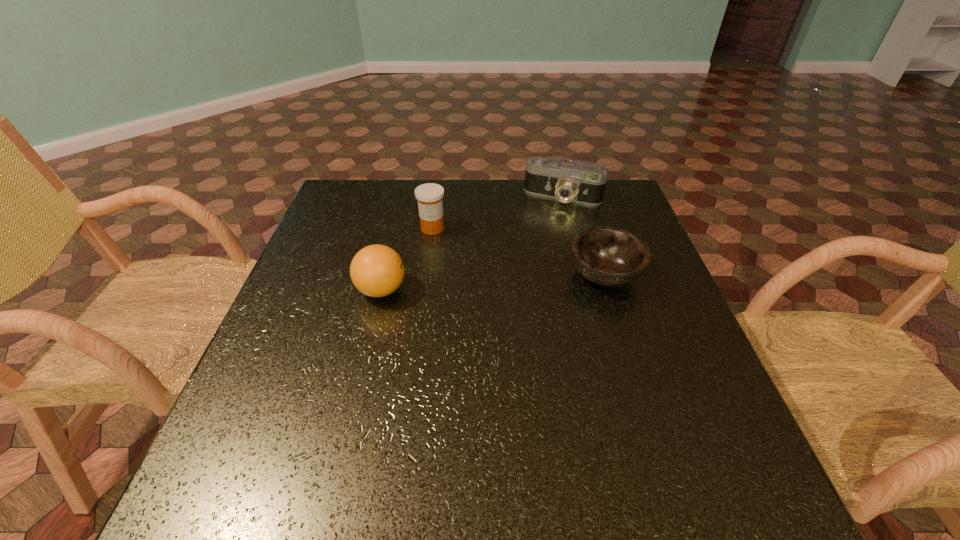
Identify the location of free spot at the near edge of the desktop. The height and width of the screenshot is (540, 960). (498, 407).

Where is `free space at the left edge`? free space at the left edge is located at coordinates (283, 328).

Where is `free space at the right edge of the desktop`? free space at the right edge of the desktop is located at coordinates point(621,305).

The image size is (960, 540). What are the coordinates of `vacant space at the far left corner` in the screenshot? It's located at (364, 217).

Find the location of a particular element. The width and height of the screenshot is (960, 540). free space at the far right corner of the desktop is located at coordinates (617, 211).

Where is `vacant space at the near right corner`? vacant space at the near right corner is located at coordinates click(706, 428).

I want to click on vacant point located between the shortest object and the leftmost object, so click(x=493, y=283).

Find the location of a particular element. free space that is in between the leftmost object and the medicine is located at coordinates (407, 259).

I want to click on free space between the third nearest object and the leftmost object, so click(407, 259).

Find the location of a particular element. The width and height of the screenshot is (960, 540). blank region between the bowl and the medicine is located at coordinates point(518,252).